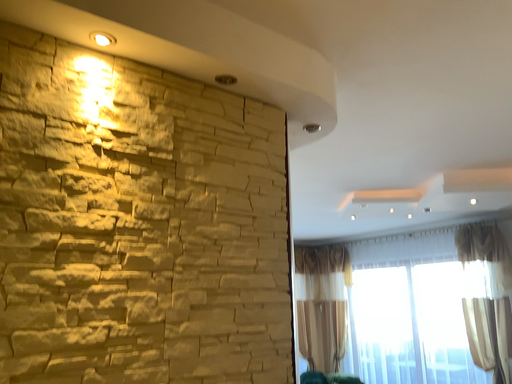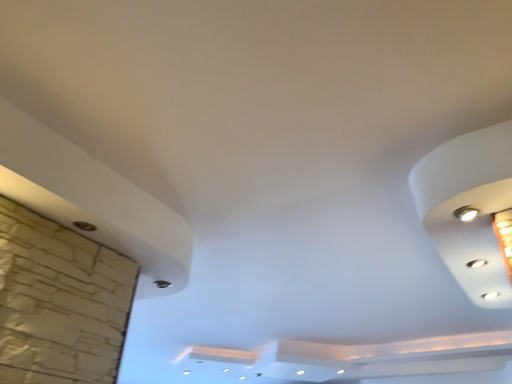
Question: How did the camera likely rotate when shooting the video?

Choices:
 (A) rotated downward
 (B) rotated upward

Answer: (B)